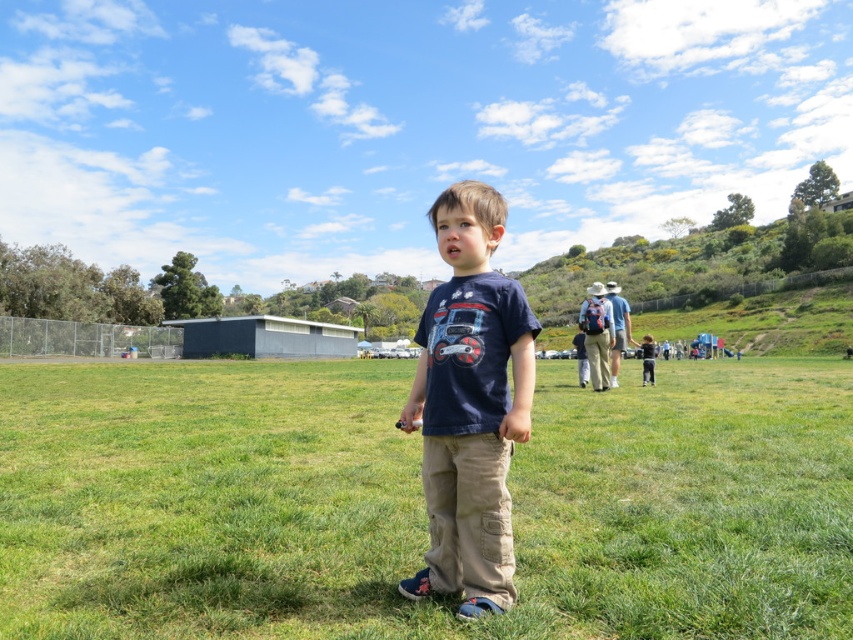
Question: Which object is closer to the camera taking this photo?

Choices:
 (A) dark blue t-shirt at center
 (B) navy blue t-shirt at center
 (C) green grassy field at center

Answer: (C)

Question: Which of the following is the closest to the observer?

Choices:
 (A) (169, 440)
 (B) (646, 364)

Answer: (A)

Question: Which point is farther to the camera?

Choices:
 (A) click(x=646, y=380)
 (B) click(x=445, y=212)

Answer: (A)

Question: In this image, where is navy blue t-shirt at center located relative to dark blue t-shirt at center?

Choices:
 (A) right
 (B) left

Answer: (B)

Question: In this image, where is green grassy field at center located relative to dark blue t-shirt at center?

Choices:
 (A) left
 (B) right

Answer: (A)

Question: Is green grassy field at center above navy blue t-shirt at center?

Choices:
 (A) yes
 (B) no

Answer: (B)